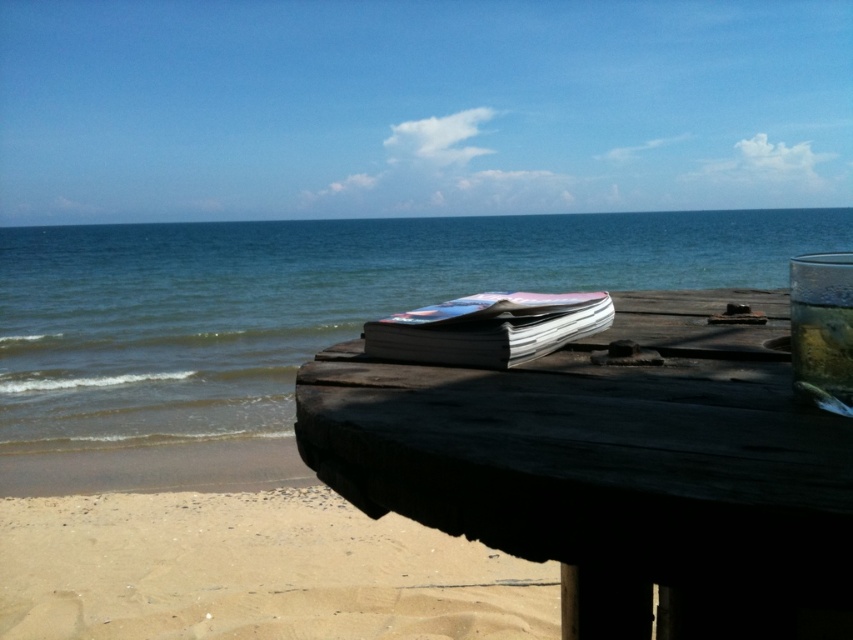
Question: Does light beige sand at lower left appear under white glossy book at center?

Choices:
 (A) yes
 (B) no

Answer: (A)

Question: Does dark wood picnic table at center have a smaller size compared to light beige sand at lower left?

Choices:
 (A) no
 (B) yes

Answer: (B)

Question: Among these objects, which one is farthest from the camera?

Choices:
 (A) light beige sand at lower left
 (B) dark wood picnic table at center

Answer: (A)

Question: Based on their relative distances, which object is farther from the blue water at center?

Choices:
 (A) light beige sand at lower left
 (B) dark wood picnic table at center

Answer: (A)

Question: Does dark wood picnic table at center have a smaller size compared to light beige sand at lower left?

Choices:
 (A) no
 (B) yes

Answer: (B)

Question: Which point is farther to the camera?

Choices:
 (A) (55, 276)
 (B) (517, 528)
 (C) (67, 552)

Answer: (A)